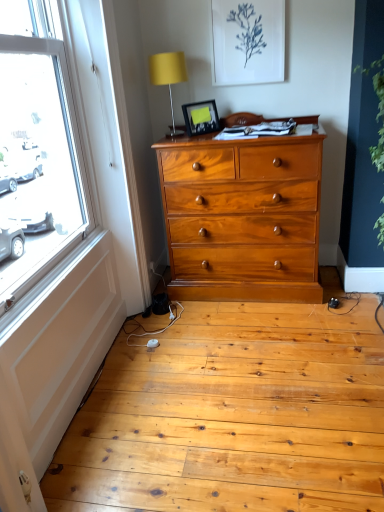
Question: Would you say matte yellow fabric at upper center is part of matte black picture frame at upper center's contents?

Choices:
 (A) yes
 (B) no

Answer: (B)

Question: From a real-world perspective, is matte black picture frame at upper center positioned under matte yellow fabric at upper center based on gravity?

Choices:
 (A) no
 (B) yes

Answer: (B)

Question: From the image's perspective, does matte black picture frame at upper center appear lower than matte yellow fabric at upper center?

Choices:
 (A) yes
 (B) no

Answer: (A)

Question: Does matte black picture frame at upper center have a lesser height compared to matte yellow fabric at upper center?

Choices:
 (A) yes
 (B) no

Answer: (A)

Question: Is matte black picture frame at upper center facing away from matte yellow fabric at upper center?

Choices:
 (A) yes
 (B) no

Answer: (A)

Question: Considering the relative sizes of matte black picture frame at upper center and matte yellow fabric at upper center in the image provided, is matte black picture frame at upper center wider than matte yellow fabric at upper center?

Choices:
 (A) yes
 (B) no

Answer: (B)

Question: Is matte black picture frame at upper center bigger than green leafy plant at right?

Choices:
 (A) yes
 (B) no

Answer: (B)

Question: From a real-world perspective, is matte black picture frame at upper center physically above green leafy plant at right?

Choices:
 (A) no
 (B) yes

Answer: (B)

Question: Is matte black picture frame at upper center at the left side of green leafy plant at right?

Choices:
 (A) no
 (B) yes

Answer: (B)

Question: From the image's perspective, is matte black picture frame at upper center located above green leafy plant at right?

Choices:
 (A) no
 (B) yes

Answer: (B)

Question: Is matte black picture frame at upper center thinner than green leafy plant at right?

Choices:
 (A) no
 (B) yes

Answer: (B)

Question: Is the position of matte black picture frame at upper center more distant than that of green leafy plant at right?

Choices:
 (A) yes
 (B) no

Answer: (A)

Question: From the image's perspective, is matte yellow fabric at upper center on matte black picture frame at upper center?

Choices:
 (A) yes
 (B) no

Answer: (A)